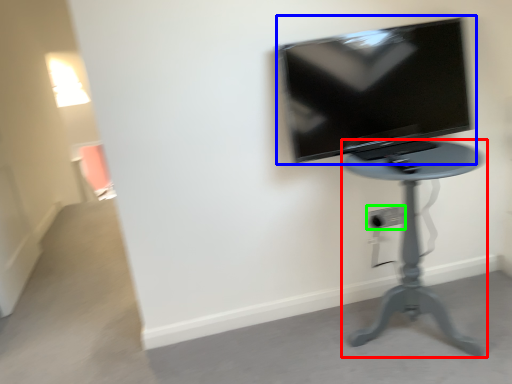
Question: Which object is the closest to the furniture (highlighted by a red box)? Choose among these: television (highlighted by a blue box) or electric outlet (highlighted by a green box).

Choices:
 (A) television
 (B) electric outlet

Answer: (A)